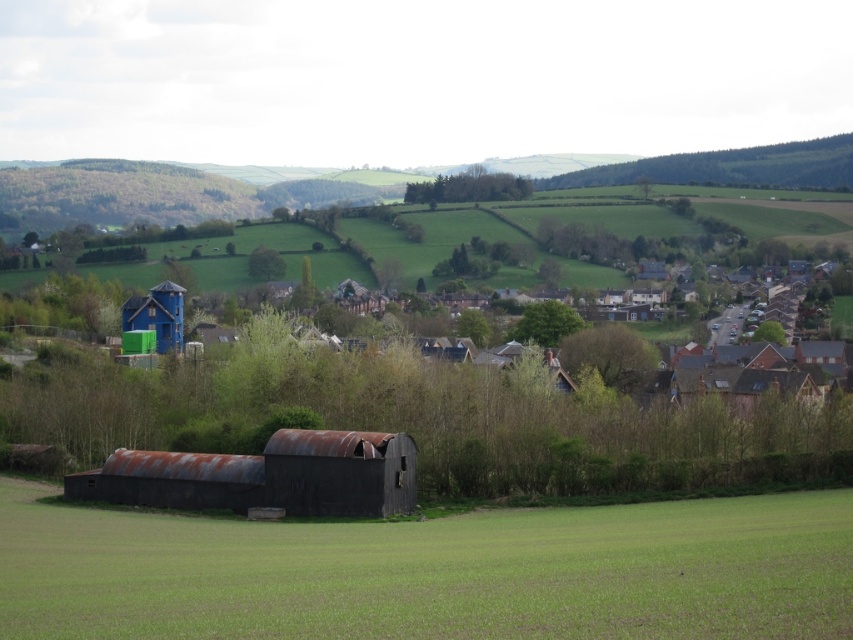
Question: Does blue wooden house at upper left have a greater width compared to rusty metal barn at lower center?

Choices:
 (A) yes
 (B) no

Answer: (A)

Question: Which object is farther from the camera taking this photo?

Choices:
 (A) rusty metal hut at center
 (B) green grassy field at lower center
 (C) blue wooden house at upper left

Answer: (C)

Question: Which of the following is the farthest from the observer?

Choices:
 (A) rusty metal hut at center
 (B) blue painted wood hut at upper left

Answer: (B)

Question: Can you confirm if rusty metal barn at lower center is bigger than rusty metal hut at center?

Choices:
 (A) yes
 (B) no

Answer: (A)

Question: Is rusty metal hut at center to the right of blue painted wood hut at upper left from the viewer's perspective?

Choices:
 (A) yes
 (B) no

Answer: (A)

Question: Estimate the real-world distances between objects in this image. Which object is farther from the rusty metal barn at lower center?

Choices:
 (A) blue wooden house at upper left
 (B) green grassy field at lower center
 (C) blue painted wood hut at upper left
 (D) rusty metal hut at center

Answer: (C)